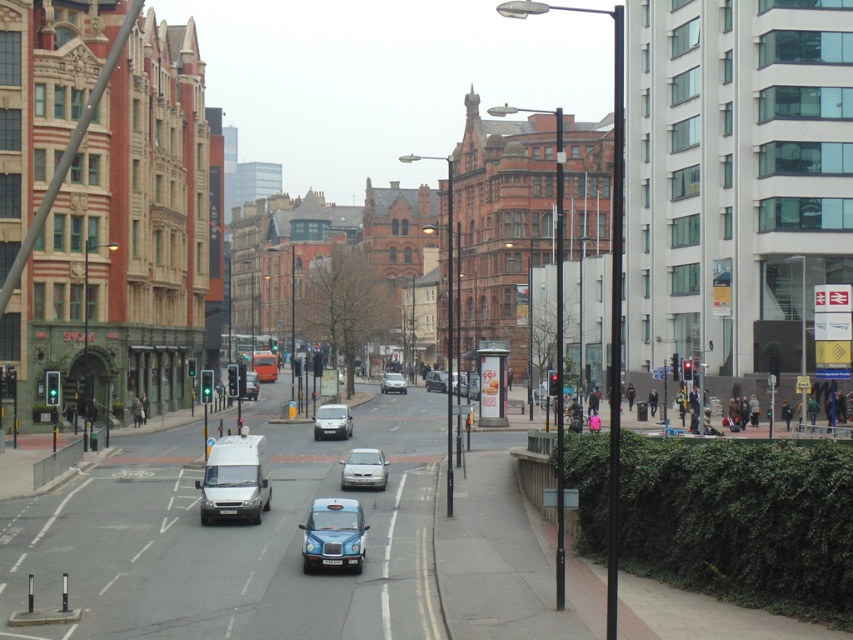
You are a pedestrian standing at the crosswalk on the left side of the street. You need to cross to the right side but want to make sure you can see both the blue metallic taxi at center and the matte silver car at center clearly while waiting. Which direction should you face to ensure both vehicles are in your line of sight?

You should face towards the right side of the street because the blue metallic taxi at center is to the right of the matte silver car at center, so facing right will keep both vehicles within your view.

You are standing on the street and see two points marked on the ground. The first point is at coordinates point (358, 524) and the second is at point (347, 406). If you are facing the direction of the street, which point is closer to you?

Point (358, 524) is in front of point (347, 406), so the first point is closer to you.